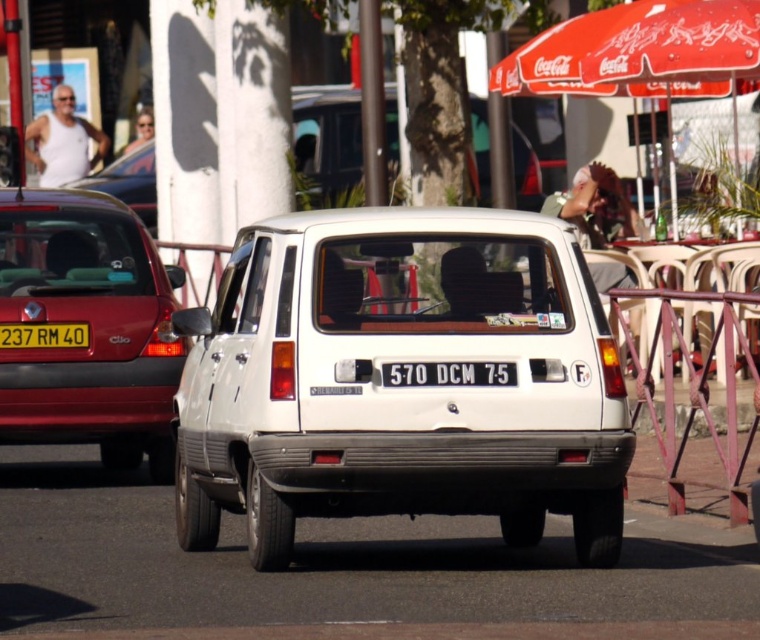
You are a pedestrian standing at the edge of the road where the black plastic license plate at center is located. You want to cross the road safely. The metallic red hatchback at left is approaching. Can you safely cross before it reaches your position?

The metallic red hatchback at left is 3.88 meters away from the black plastic license plate at center. Since you are at the license plate location, you need to consider the vehicle speed. Assuming average speed of 30 kmh, it would take about 0.45 seconds to reach you. This is too dangerous to cross. Wait for the vehicle to pass first.

You are standing on the sidewalk and see the metallic red hatchback at left and the white Renault 4L in the street. If you want to cross the street to the white Renault 4L, which vehicle is closer to you?

The metallic red hatchback at left is closer to you because it is only 36.55 feet away, whereas the white Renault 4L is farther away.

Based on the scene description, where is the white matte van at center located in terms of coordinates?

The white matte van at center is located at coordinates point [401,387].